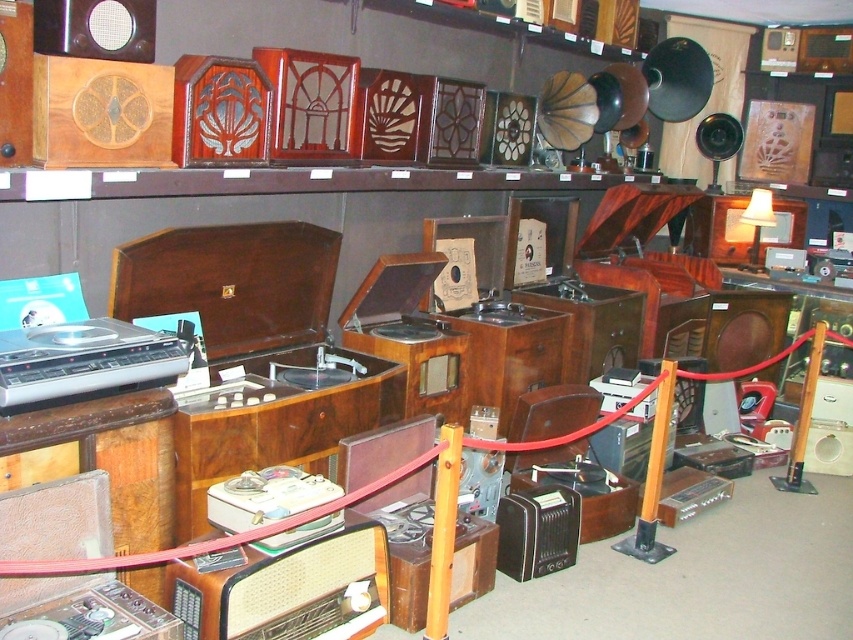
Question: Is silver metallic turntable at left closer to the viewer compared to matte black speaker at upper left?

Choices:
 (A) yes
 (B) no

Answer: (A)

Question: Is silver metallic turntable at left to the right of matte black speaker at upper left from the viewer's perspective?

Choices:
 (A) yes
 (B) no

Answer: (B)

Question: Can you confirm if silver metallic turntable at left is positioned to the left of matte black speaker at upper left?

Choices:
 (A) yes
 (B) no

Answer: (A)

Question: Among these points, which one is nearest to the camera?

Choices:
 (A) pos(158,378)
 (B) pos(146,28)

Answer: (A)